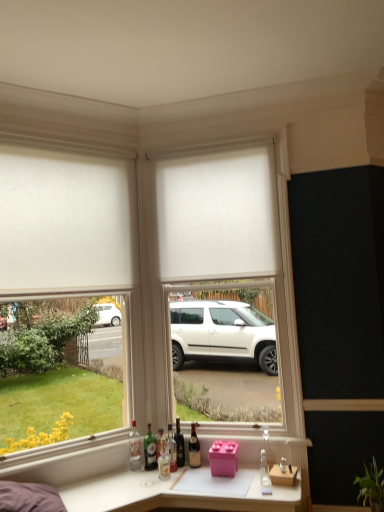
Find the location of a particular element. Image resolution: width=384 pixels, height=512 pixels. vacant region to the left of translucent glass bottle at center, which ranks as the fourth bottle in left-to-right order is located at coordinates (145, 475).